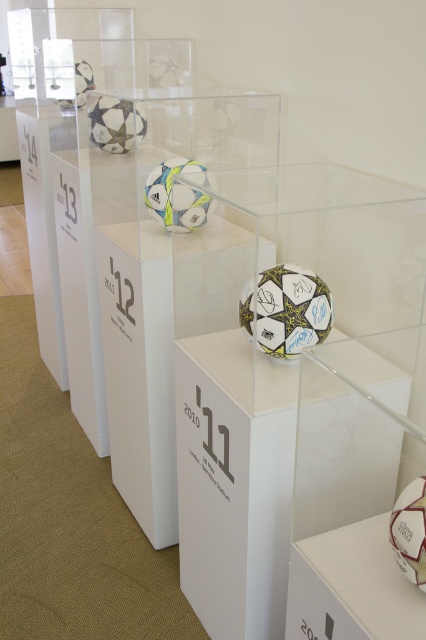
From the picture: Which of these two, white leather football at center or white matte football at center, stands taller?

white matte football at center

Does white leather football at center appear over white matte football at center?

Actually, white leather football at center is below white matte football at center.

Locate an element on the screen. white leather football at center is located at coordinates (290, 308).

Locate an element on the screen. The width and height of the screenshot is (426, 640). white leather football at center is located at coordinates (290, 308).

Does white glossy soccer ball at lower right have a greater height compared to white matte football at center?

No, white glossy soccer ball at lower right is not taller than white matte football at center.

The width and height of the screenshot is (426, 640). In order to click on white glossy soccer ball at lower right in this screenshot , I will do pos(351,588).

You are a GUI agent. You are given a task and a screenshot of the screen. Output one action in this format:
    pyautogui.click(x=<x>, y=<y>)
    Task: Click on the white glossy soccer ball at lower right
    Image resolution: width=426 pixels, height=640 pixels.
    Given the screenshot: What is the action you would take?
    pyautogui.click(x=351, y=588)

Between clear acrylic ball at center and white matte football at center, which one is positioned lower?

Positioned lower is clear acrylic ball at center.

Looking at this image, can you confirm if clear acrylic ball at center is taller than white matte football at center?

Indeed, clear acrylic ball at center has a greater height compared to white matte football at center.

This screenshot has height=640, width=426. Describe the element at coordinates (296, 388) in the screenshot. I see `clear acrylic ball at center` at that location.

Image resolution: width=426 pixels, height=640 pixels. Find the location of `clear acrylic ball at center`. clear acrylic ball at center is located at coordinates (296, 388).